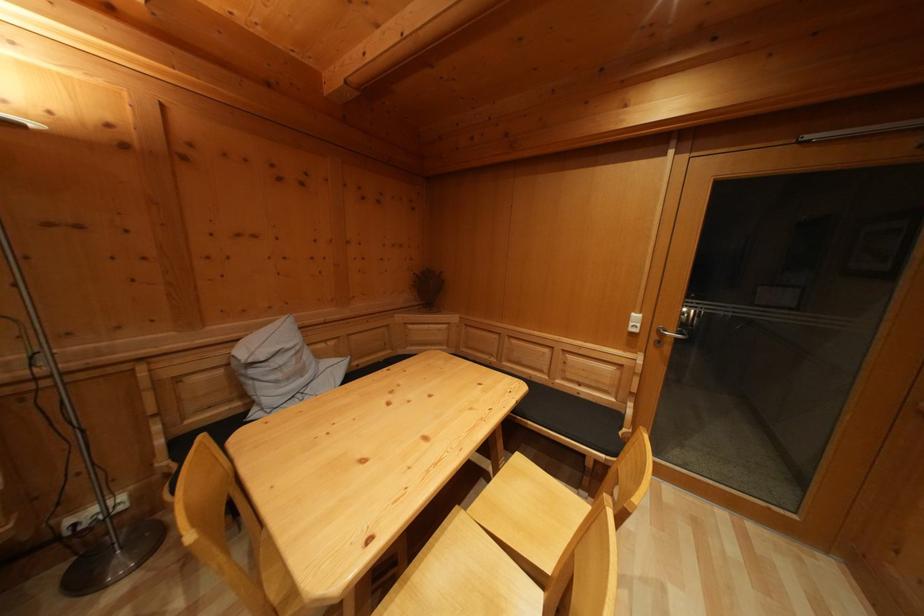
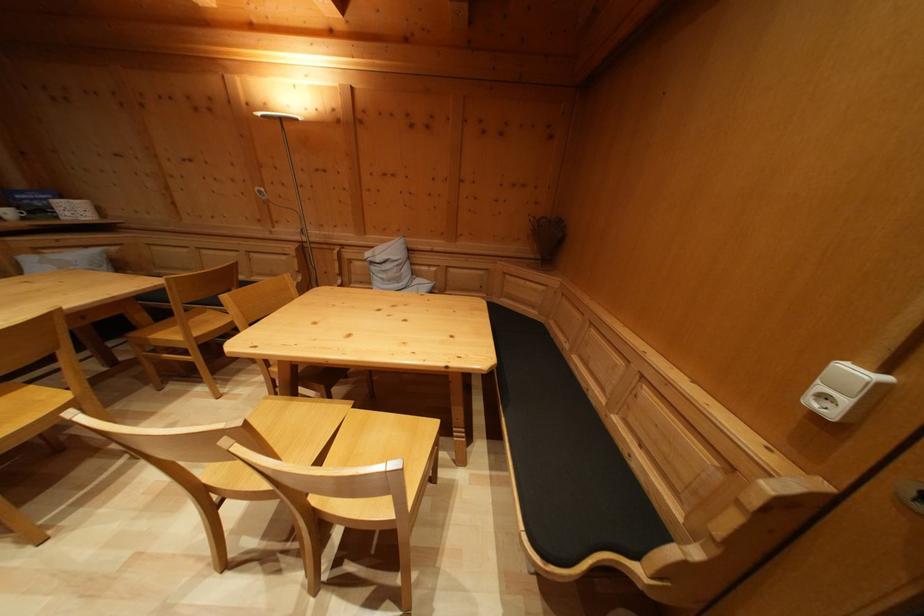
The point at (464,514) is marked in the first image. Where is the corresponding point in the second image?

(359, 408)